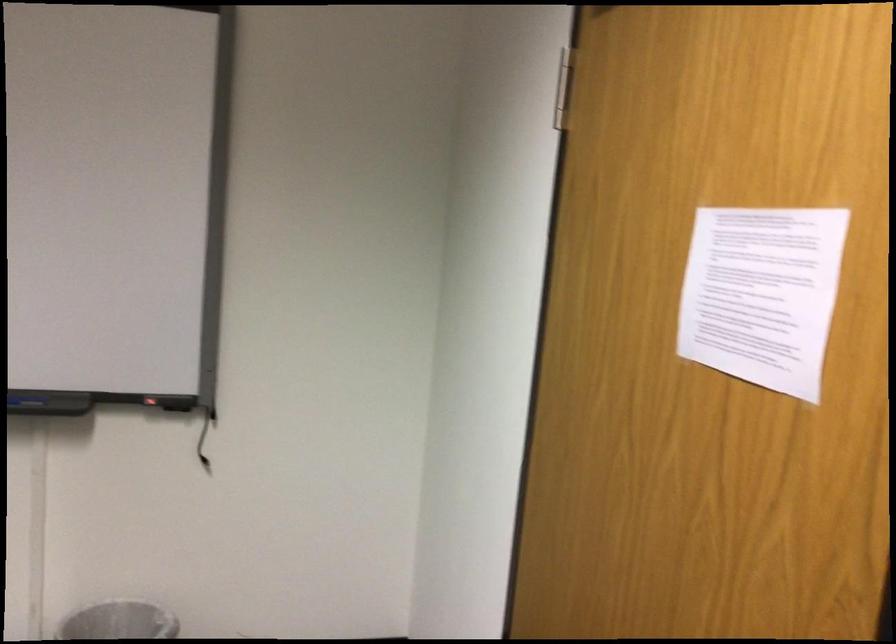
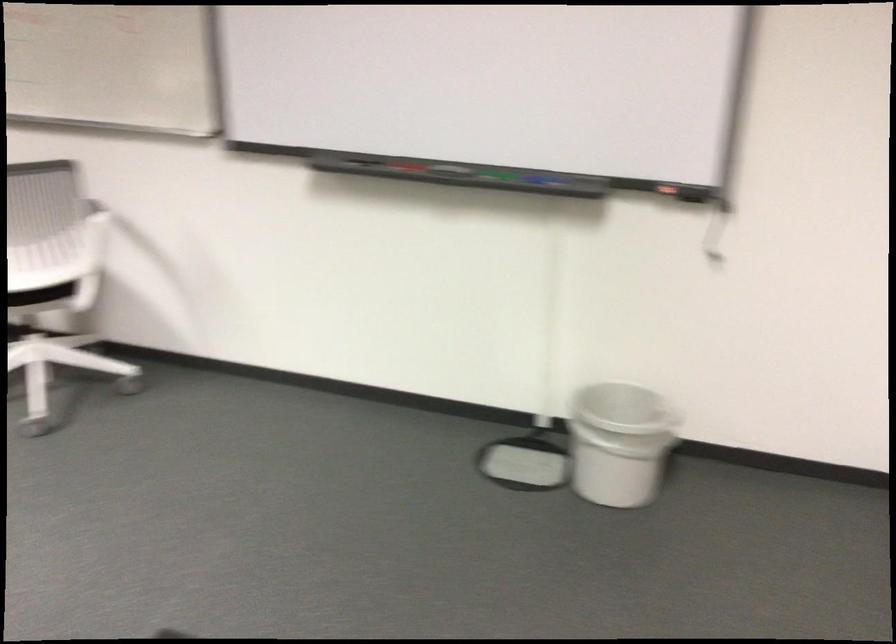
Question: Based on the continuous images, in which direction is the camera rotating? Reply with the corresponding letter.

Choices:
 (A) Left
 (B) Right
 (C) Up
 (D) Down

Answer: (A)